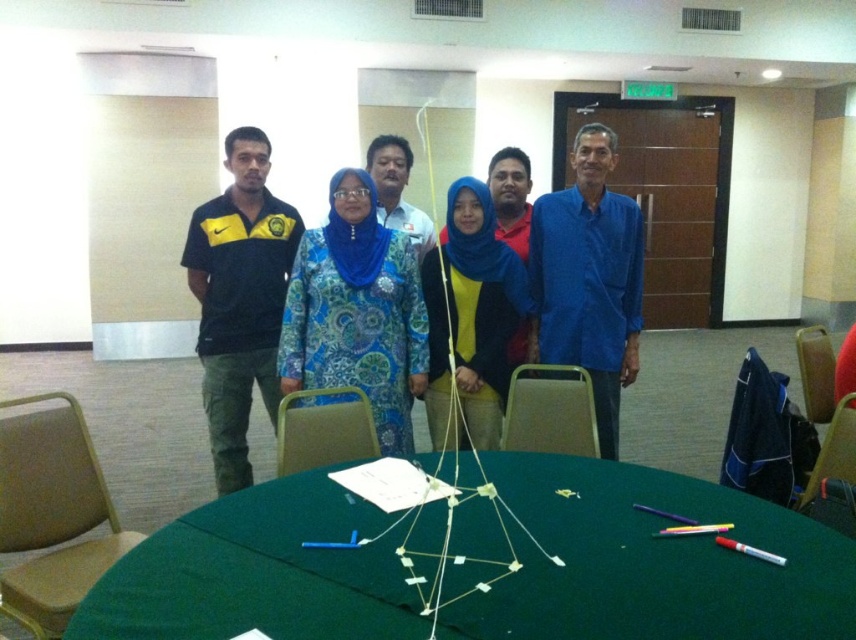
You are organizing a photo shoot and need to ensure that the blue printed dress at center and the matte black polo shirt at left are visible. Based on their positions, which clothing item is closer to the camera?

The blue printed dress at center is closer to the camera because it is in front of the matte black polo shirt at left.

Based on the scene description, which object is positioned to the right of the other between the green fabric table at center and the blue printed dress at center?

The green fabric table at center is to the right of the blue printed dress at center.

You are standing in the conference room and need to reach both the point at coordinates (387, 333) and the point at coordinates (265, 360). Which point should you walk towards first to reach the one closer to you?

You should walk towards point (387, 333) first because it is closer to you than point (265, 360).